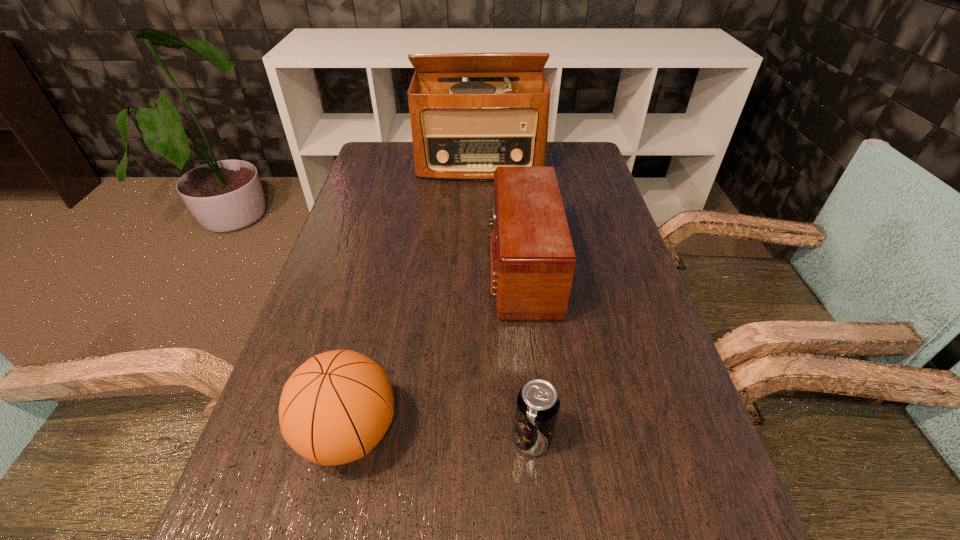
The image size is (960, 540). I want to click on the taller radio receiver, so click(461, 130).

The height and width of the screenshot is (540, 960). I want to click on the farther radio receiver, so click(461, 130).

Find the location of `the third nearest object`. the third nearest object is located at coordinates (532, 260).

Find the location of a particular element. The height and width of the screenshot is (540, 960). the shorter radio receiver is located at coordinates [532, 260].

Find the location of a particular element. The height and width of the screenshot is (540, 960). basketball is located at coordinates (336, 407).

The image size is (960, 540). In order to click on the shortest object in this screenshot , I will do `click(537, 406)`.

Find the location of a particular element. Image resolution: width=960 pixels, height=540 pixels. vacant space located on the front panel of the farthest object is located at coordinates (480, 261).

The height and width of the screenshot is (540, 960). In order to click on free space located 0.350m on the front-facing side of the shorter radio receiver in this screenshot , I will do `click(345, 268)`.

Locate an element on the screen. The image size is (960, 540). vacant area situated 0.050m on the front-facing side of the shorter radio receiver is located at coordinates (468, 268).

This screenshot has height=540, width=960. What are the coordinates of `vacant area situated 0.060m on the front-facing side of the shorter radio receiver` in the screenshot? It's located at (464, 268).